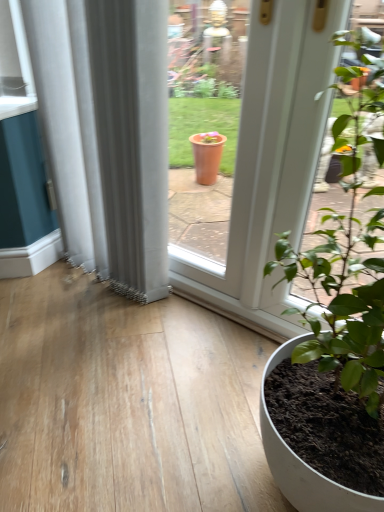
Find the location of a particular element. The height and width of the screenshot is (512, 384). free space to the left of green matte plant at right is located at coordinates (162, 415).